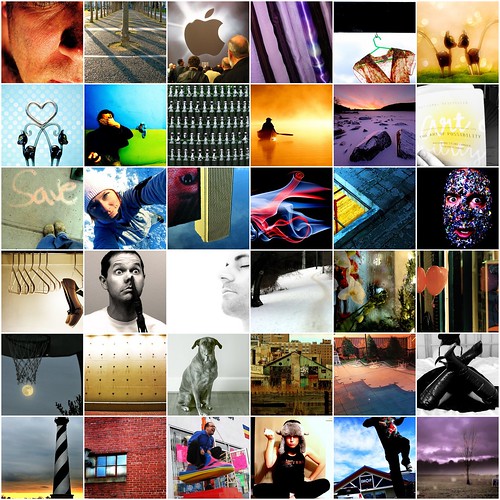
I want to click on pictures in  2nd row from top, so click(34, 110), click(109, 118), click(199, 120), click(296, 126), click(373, 128), click(459, 129).